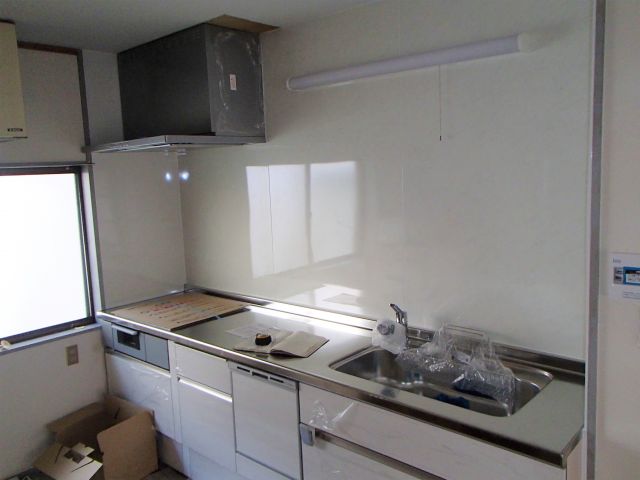
Locate an element on the screen. The width and height of the screenshot is (640, 480). metallic kitchen counter is located at coordinates (223, 333), (534, 424).